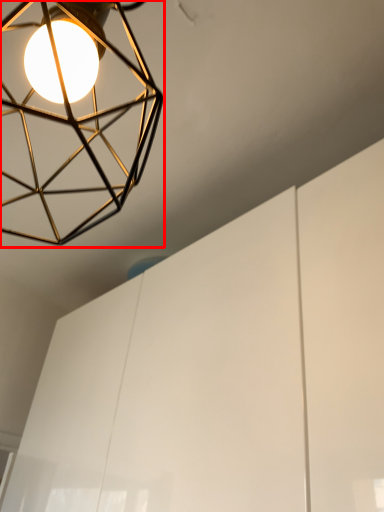
Question: From the image's perspective, what is the correct spatial positioning of lamp (annotated by the red box) in reference to cabinetry?

Choices:
 (A) above
 (B) below

Answer: (A)